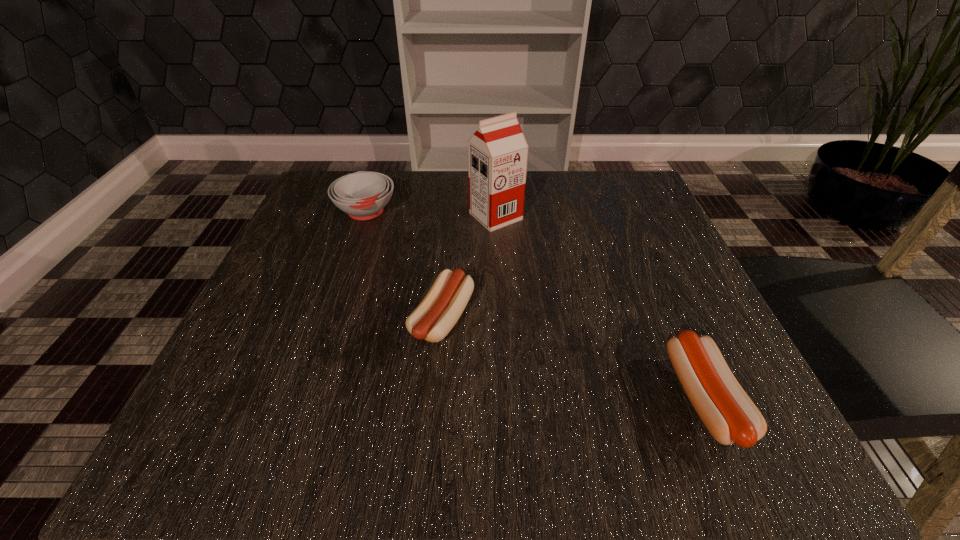
Where is `soya milk`? soya milk is located at coordinates (497, 152).

You are a GUI agent. You are given a task and a screenshot of the screen. Output one action in this format:
    pyautogui.click(x=<x>, y=<y>)
    Task: Click on the leftmost object
    The image size is (960, 540).
    Given the screenshot: What is the action you would take?
    pyautogui.click(x=363, y=195)

Where is `the second tallest object`? The height and width of the screenshot is (540, 960). the second tallest object is located at coordinates (363, 195).

I want to click on the left sausage, so click(436, 315).

I want to click on the rightmost object, so click(x=728, y=413).

Where is `free spot located on the left of the soya milk`? free spot located on the left of the soya milk is located at coordinates (299, 217).

At what (x,y) coordinates should I click in order to perform the action: click on vacant space located 0.140m on the right of the soup bowl. Please return your answer as a coordinate pair (x, y). The height and width of the screenshot is (540, 960). Looking at the image, I should click on (462, 212).

I want to click on vacant space located 0.270m on the back of the left sausage, so click(x=452, y=204).

At what (x,y) coordinates should I click in order to perform the action: click on vacant area situated on the back of the rightmost object. Please return your answer as a coordinate pair (x, y). The image size is (960, 540). Looking at the image, I should click on (641, 253).

This screenshot has width=960, height=540. In order to click on soya milk that is positioned at the far edge in this screenshot , I will do `click(497, 152)`.